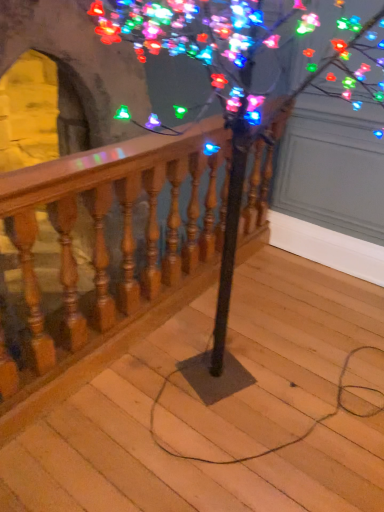
Question: Is wooden at center far away from wooden baluster at center?

Choices:
 (A) no
 (B) yes

Answer: (A)

Question: Considering the relative sizes of wooden at center and wooden baluster at center in the image provided, is wooden at center bigger than wooden baluster at center?

Choices:
 (A) no
 (B) yes

Answer: (B)

Question: Can we say wooden at center lies outside wooden baluster at center?

Choices:
 (A) yes
 (B) no

Answer: (A)

Question: Can you confirm if wooden at center is positioned to the left of wooden baluster at center?

Choices:
 (A) no
 (B) yes

Answer: (A)

Question: Is wooden at center thinner than wooden baluster at center?

Choices:
 (A) no
 (B) yes

Answer: (A)

Question: Based on their positions, is wooden at center located to the left or right of wooden baluster at center?

Choices:
 (A) left
 (B) right

Answer: (B)

Question: In the image, is wooden at center positioned in front of or behind wooden baluster at center?

Choices:
 (A) front
 (B) behind

Answer: (A)

Question: From a real-world perspective, is wooden at center positioned above or below wooden baluster at center?

Choices:
 (A) above
 (B) below

Answer: (B)

Question: Considering the positions of wooden at center and wooden baluster at center in the image, is wooden at center taller or shorter than wooden baluster at center?

Choices:
 (A) tall
 (B) short

Answer: (B)

Question: Does point (241, 294) appear closer or farther from the camera than point (148, 16)?

Choices:
 (A) closer
 (B) farther

Answer: (B)

Question: Is wooden at center spatially inside multicolored lights at upper center, or outside of it?

Choices:
 (A) outside
 (B) inside

Answer: (A)

Question: From a real-world perspective, relative to multicolored lights at upper center, is wooden at center vertically above or below?

Choices:
 (A) above
 (B) below

Answer: (B)

Question: Considering the relative positions of wooden at center and multicolored lights at upper center in the image provided, is wooden at center to the left or to the right of multicolored lights at upper center?

Choices:
 (A) right
 (B) left

Answer: (B)

Question: Is multicolored lights at upper center wider or thinner than wooden at center?

Choices:
 (A) thin
 (B) wide

Answer: (A)

Question: From a real-world perspective, is multicolored lights at upper center physically located above or below wooden at center?

Choices:
 (A) below
 (B) above

Answer: (B)